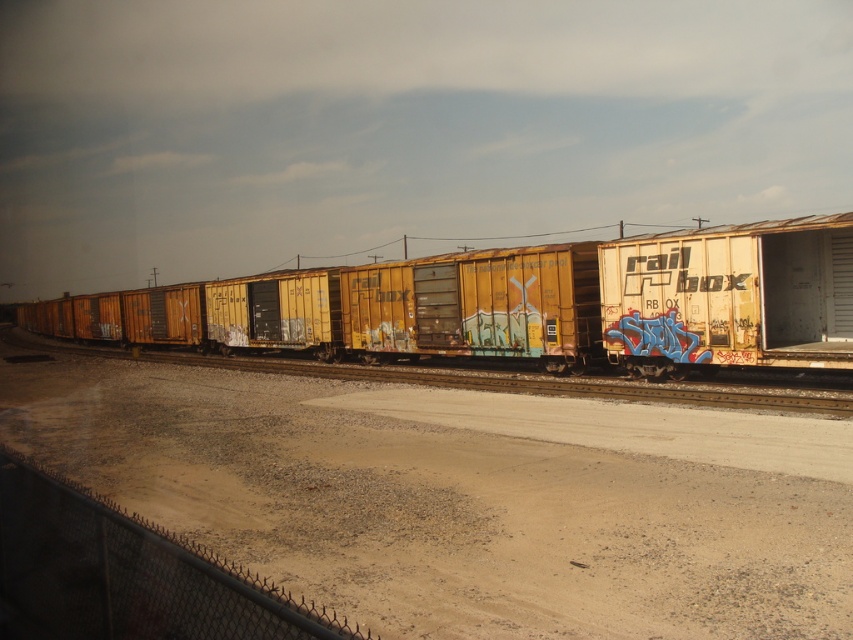
Does brown gravel dirt track at center lie behind yellow weathered boxcar at center?

No.

Can you confirm if brown gravel dirt track at center is positioned to the left of yellow weathered boxcar at center?

Incorrect, brown gravel dirt track at center is not on the left side of yellow weathered boxcar at center.

This screenshot has height=640, width=853. I want to click on brown gravel dirt track at center, so click(463, 499).

Identify the location of brown gravel dirt track at center. Image resolution: width=853 pixels, height=640 pixels. (463, 499).

Is yellow weathered boxcar at center to the left of yellow matte train car at center from the viewer's perspective?

In fact, yellow weathered boxcar at center is to the right of yellow matte train car at center.

Does yellow weathered boxcar at center have a greater height compared to yellow matte train car at center?

Yes, yellow weathered boxcar at center is taller than yellow matte train car at center.

At what (x,y) coordinates should I click in order to perform the action: click on yellow weathered boxcar at center. Please return your answer as a coordinate pair (x, y). This screenshot has width=853, height=640. Looking at the image, I should click on (581, 301).

Can you confirm if brown gravel dirt track at center is smaller than yellow matte train car at center?

Correct, brown gravel dirt track at center occupies less space than yellow matte train car at center.

Does brown gravel dirt track at center appear over yellow matte train car at center?

Actually, brown gravel dirt track at center is below yellow matte train car at center.

Which is behind, point (316, 550) or point (238, 358)?

Point (238, 358)

Where is `brown gravel dirt track at center`? brown gravel dirt track at center is located at coordinates (463, 499).